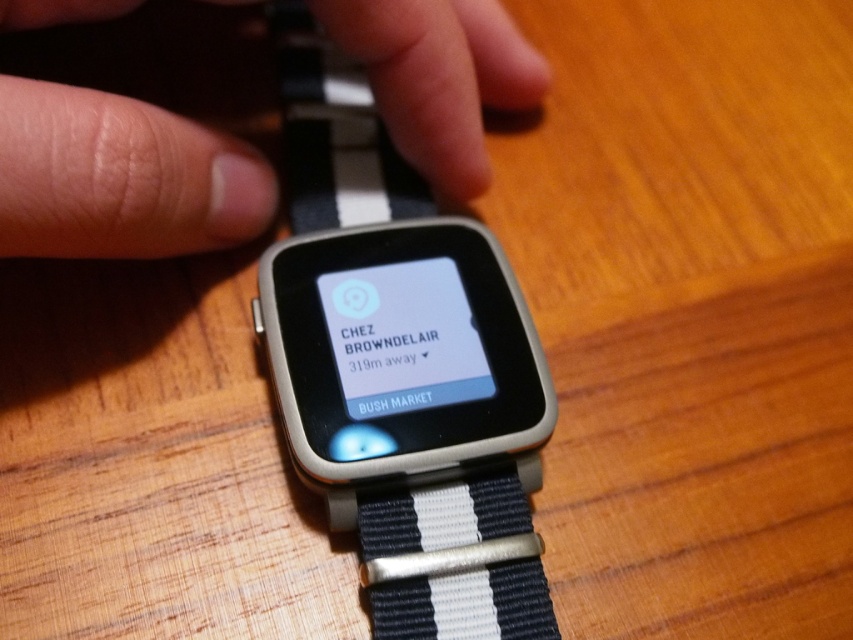
You are trying to decide which watch band to choose based on size. The scene shows a smartwatch on a wooden table with both the black woven band at center and the white matte watch band at center. Which band would you pick if you want the smaller one?

The black woven band at center is smaller than the white matte watch band at center, so you should pick the black woven band at center.